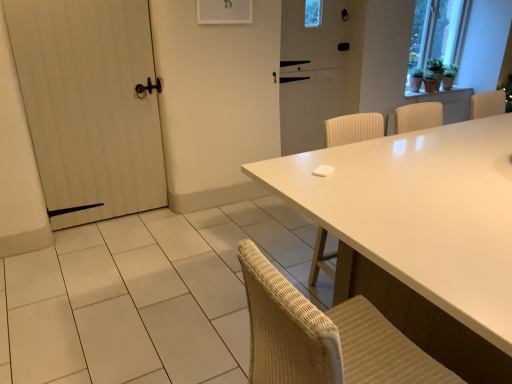
Question: Considering the relative positions of green matte plant at upper right and white wooden door at left in the image provided, is green matte plant at upper right behind white wooden door at left?

Choices:
 (A) no
 (B) yes

Answer: (B)

Question: Is green matte plant at upper right aimed at white wooden door at left?

Choices:
 (A) no
 (B) yes

Answer: (A)

Question: From the image's perspective, does green matte plant at upper right appear higher than white wooden door at left?

Choices:
 (A) no
 (B) yes

Answer: (B)

Question: Does green matte plant at upper right have a larger size compared to white wooden door at left?

Choices:
 (A) no
 (B) yes

Answer: (A)

Question: Can you confirm if green matte plant at upper right is wider than white wooden door at left?

Choices:
 (A) yes
 (B) no

Answer: (A)

Question: Does green matte plant at upper right have a lesser height compared to white wooden door at left?

Choices:
 (A) yes
 (B) no

Answer: (A)

Question: Is white wooden door at left at the back of white matte screen door at center?

Choices:
 (A) yes
 (B) no

Answer: (B)

Question: Could you tell me if white matte screen door at center is facing white wooden door at left?

Choices:
 (A) yes
 (B) no

Answer: (B)

Question: Is white wooden door at left completely or partially inside white matte screen door at center?

Choices:
 (A) no
 (B) yes

Answer: (A)

Question: Can you confirm if white matte screen door at center is smaller than white wooden door at left?

Choices:
 (A) yes
 (B) no

Answer: (A)

Question: From a real-world perspective, is white matte screen door at center under white wooden door at left?

Choices:
 (A) no
 (B) yes

Answer: (A)

Question: Is white matte screen door at center not near white wooden door at left?

Choices:
 (A) yes
 (B) no

Answer: (A)

Question: Is white glossy table at center positioned with its back to white matte screen door at center?

Choices:
 (A) yes
 (B) no

Answer: (B)